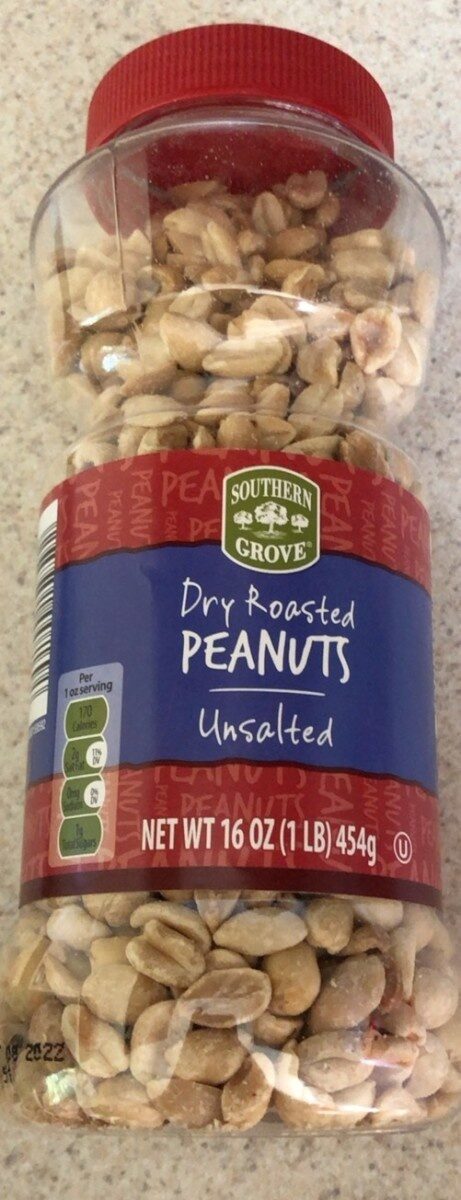
The width and height of the screenshot is (461, 1200). Identify the location of underside of lid. (253, 148).